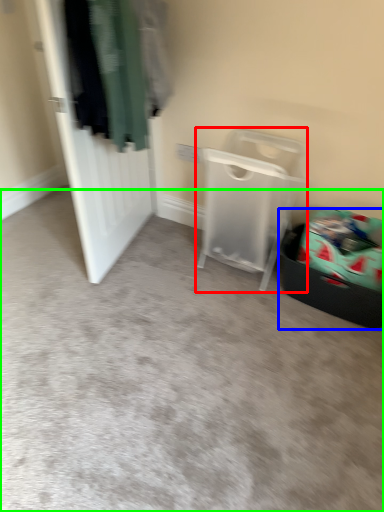
Question: Which object is positioned closest to furniture (highlighted by a red box)? Select from laundry basket (highlighted by a blue box) and plain (highlighted by a green box).

Choices:
 (A) laundry basket
 (B) plain

Answer: (A)